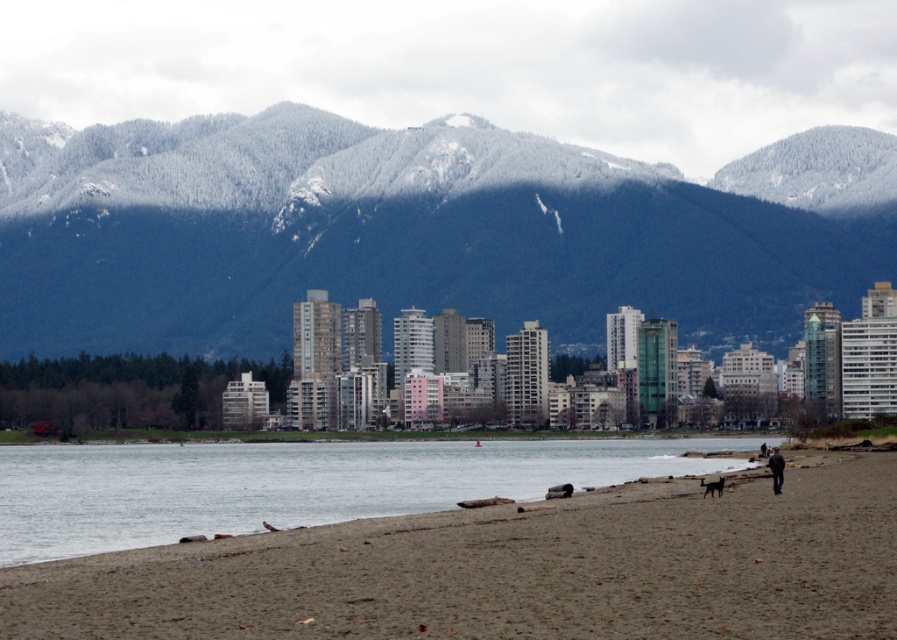
Question: Is snowy forested mountain at upper center positioned behind dark blue jacket at lower right?

Choices:
 (A) no
 (B) yes

Answer: (B)

Question: Is brown sandy beach at lower center to the left of dark blue jacket at lower right from the viewer's perspective?

Choices:
 (A) no
 (B) yes

Answer: (B)

Question: Which of the following is the closest to the observer?

Choices:
 (A) dark blue jacket at lower right
 (B) brown sandy beach at lower center
 (C) snowy forested mountain at upper center

Answer: (B)

Question: Which point is closer to the camera taking this photo?

Choices:
 (A) 368,536
 (B) 777,474

Answer: (A)

Question: Which is nearer to the dark blue jacket at lower right?

Choices:
 (A) brown sandy beach at lower center
 (B) snowy forested mountain at upper center

Answer: (A)

Question: Does snowy forested mountain at upper center appear on the left side of dark blue jacket at lower right?

Choices:
 (A) yes
 (B) no

Answer: (A)